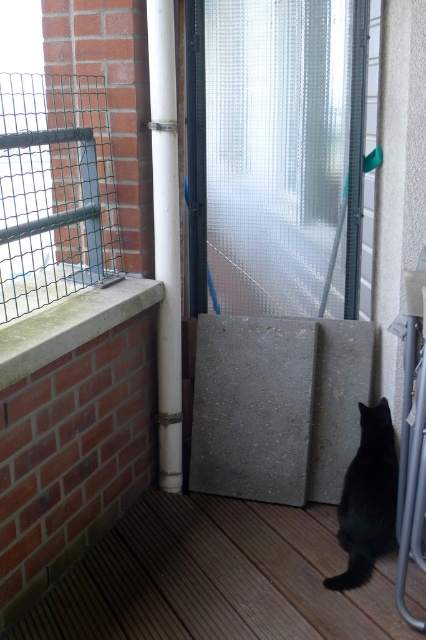
Question: Observing the image, what is the correct spatial positioning of green wire mesh at upper left in reference to black matte cat at lower right?

Choices:
 (A) left
 (B) right

Answer: (A)

Question: Which point appears farthest from the camera in this image?

Choices:
 (A) (229, 269)
 (B) (46, 337)
 (C) (376, 429)

Answer: (A)

Question: Can you confirm if frosted glass door at center is positioned below concrete/stone step at center?

Choices:
 (A) yes
 (B) no

Answer: (B)

Question: Which of these objects is positioned farthest from the concrete ledge at upper left?

Choices:
 (A) concrete/stone step at center
 (B) brown wooden deck at lower center
 (C) white plastic pipe at center
 (D) green wire mesh at upper left

Answer: (B)

Question: Which point is farther from the camera taking this photo?

Choices:
 (A) (31, 227)
 (B) (152, 97)
 (C) (39, 332)

Answer: (B)

Question: Does concrete/stone step at center have a lesser width compared to black matte cat at lower right?

Choices:
 (A) no
 (B) yes

Answer: (A)